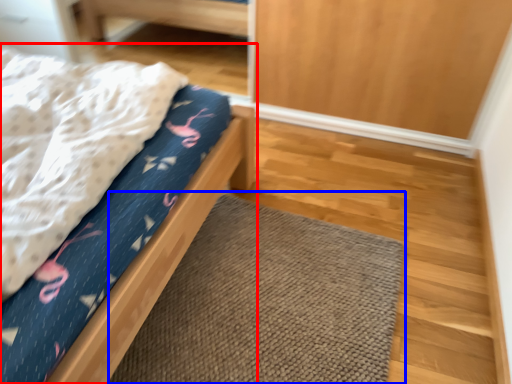
Question: Among these objects, which one is nearest to the camera, bed (highlighted by a red box) or doormat (highlighted by a blue box)?

Choices:
 (A) bed
 (B) doormat

Answer: (A)